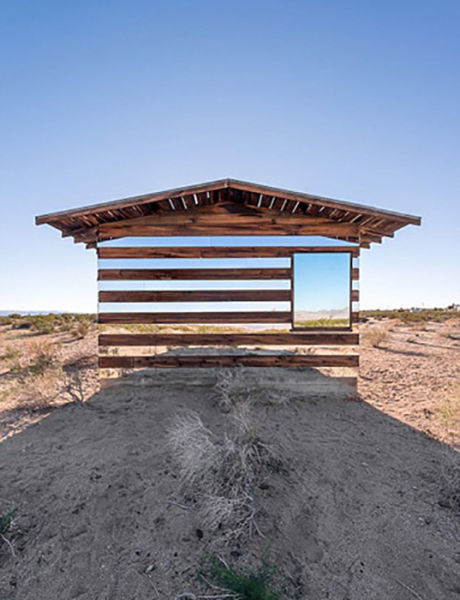
Locate an element on the screen. Image resolution: width=460 pixels, height=600 pixels. wood slat is located at coordinates (160, 361), (178, 345), (175, 318), (170, 295), (169, 273), (155, 254).